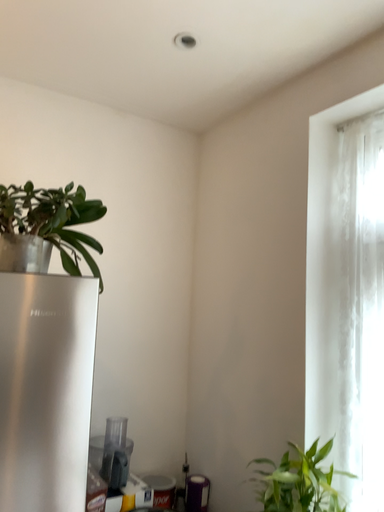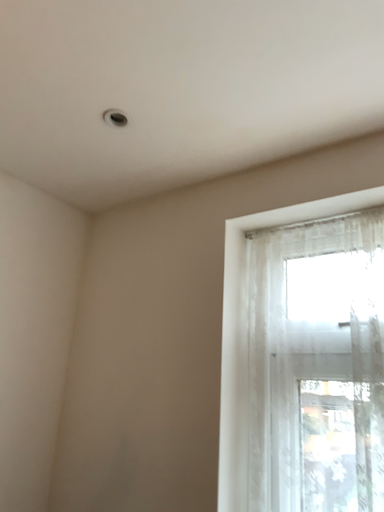
Question: Which way did the camera rotate in the video?

Choices:
 (A) rotated upward
 (B) rotated downward

Answer: (A)